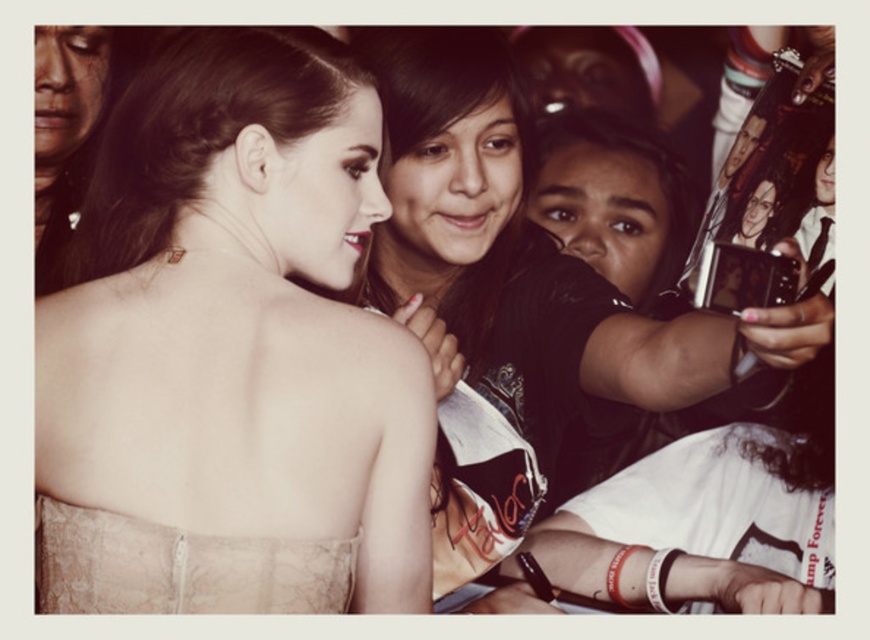
Is point (425, 586) farther from viewer compared to point (586, 358)?

No, (425, 586) is closer to viewer.

Between lace dress at center and matte black dress at center, which one is positioned lower?

Positioned lower is matte black dress at center.

You are a GUI agent. You are given a task and a screenshot of the screen. Output one action in this format:
    pyautogui.click(x=<x>, y=<y>)
    Task: Click on the lace dress at center
    The width and height of the screenshot is (870, 640).
    Given the screenshot: What is the action you would take?
    pyautogui.click(x=239, y=317)

Is matte black dress at center bigger than matte black camera at right?

Yes.

Who is lower down, matte black dress at center or matte black camera at right?

matte black dress at center is lower down.

The image size is (870, 640). Find the location of `matte black dress at center`. matte black dress at center is located at coordinates (524, 252).

Looking at this image, is lace fabric dress at center in front of matte black camera at right?

Yes, lace fabric dress at center is in front of matte black camera at right.

Can you confirm if lace fabric dress at center is wider than matte black camera at right?

No.

What do you see at coordinates (179, 568) in the screenshot? I see `lace fabric dress at center` at bounding box center [179, 568].

You are a GUI agent. You are given a task and a screenshot of the screen. Output one action in this format:
    pyautogui.click(x=<x>, y=<y>)
    Task: Click on the lace fabric dress at center
    Image resolution: width=870 pixels, height=640 pixels.
    Given the screenshot: What is the action you would take?
    pyautogui.click(x=179, y=568)